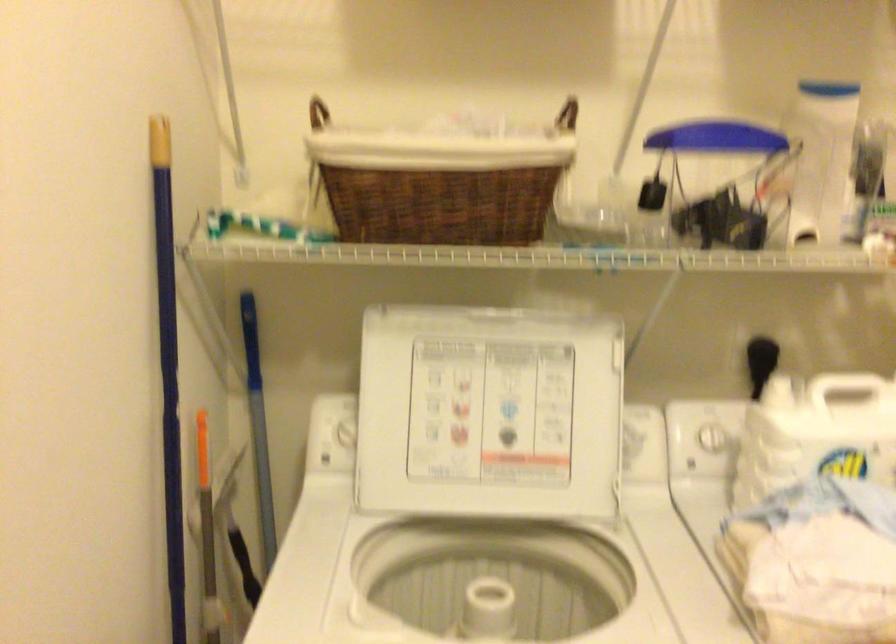
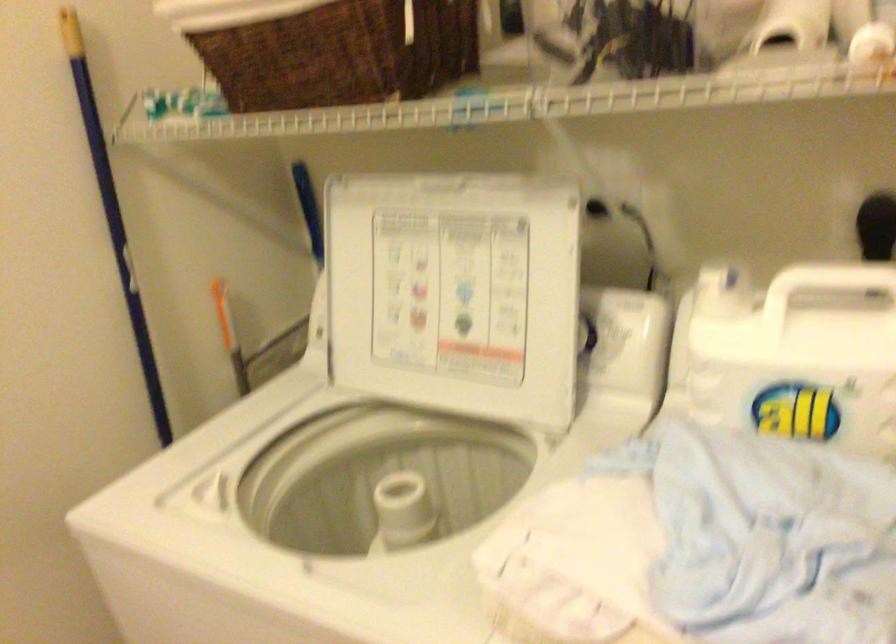
Question: Based on the continuous images, in which direction is the camera rotating? Reply with the corresponding letter.

Choices:
 (A) Left
 (B) Right
 (C) Up
 (D) Down

Answer: (A)